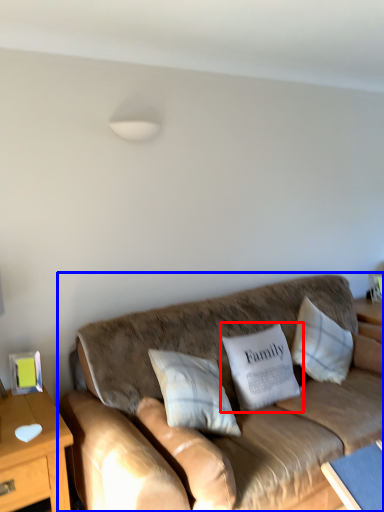
Question: Which object appears farthest to the camera in this image, pillow (highlighted by a red box) or studio couch (highlighted by a blue box)?

Choices:
 (A) pillow
 (B) studio couch

Answer: (A)